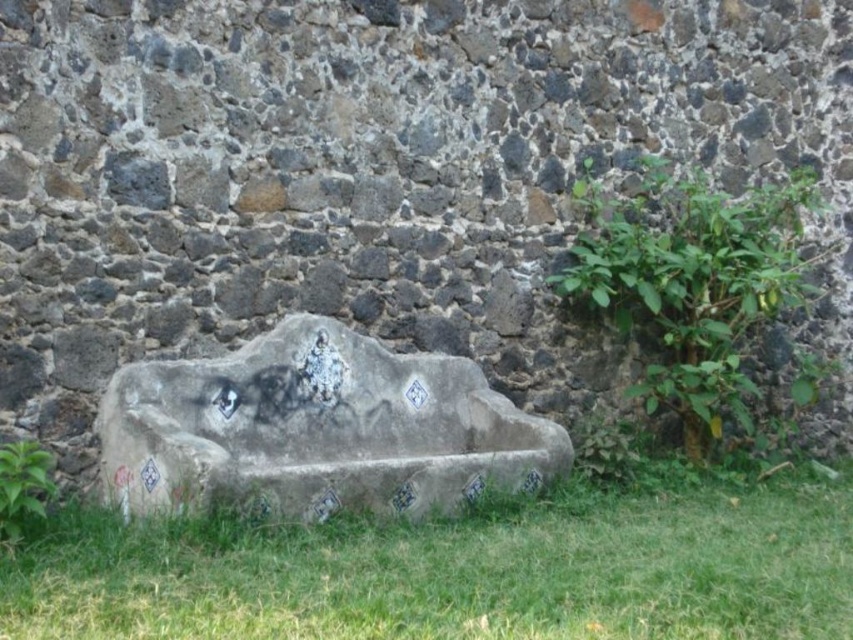
Question: Which object appears farthest from the camera in this image?

Choices:
 (A) green grass at lower center
 (B) green leafy plant at right
 (C) green leafy plant at lower left

Answer: (B)

Question: Does green grass at lower center appear on the right side of gray concrete bench at center?

Choices:
 (A) no
 (B) yes

Answer: (B)

Question: Is gray concrete bench at center to the right of green leafy plant at right from the viewer's perspective?

Choices:
 (A) no
 (B) yes

Answer: (A)

Question: Where is gray concrete bench at center located in relation to green leafy plant at lower left in the image?

Choices:
 (A) above
 (B) below

Answer: (A)

Question: Which object appears closest to the camera in this image?

Choices:
 (A) green leafy plant at right
 (B) green grass at lower center

Answer: (B)

Question: Which of the following is the farthest from the observer?

Choices:
 (A) green leafy plant at right
 (B) green grass at lower center
 (C) green leafy plant at lower left
 (D) gray concrete bench at center

Answer: (A)